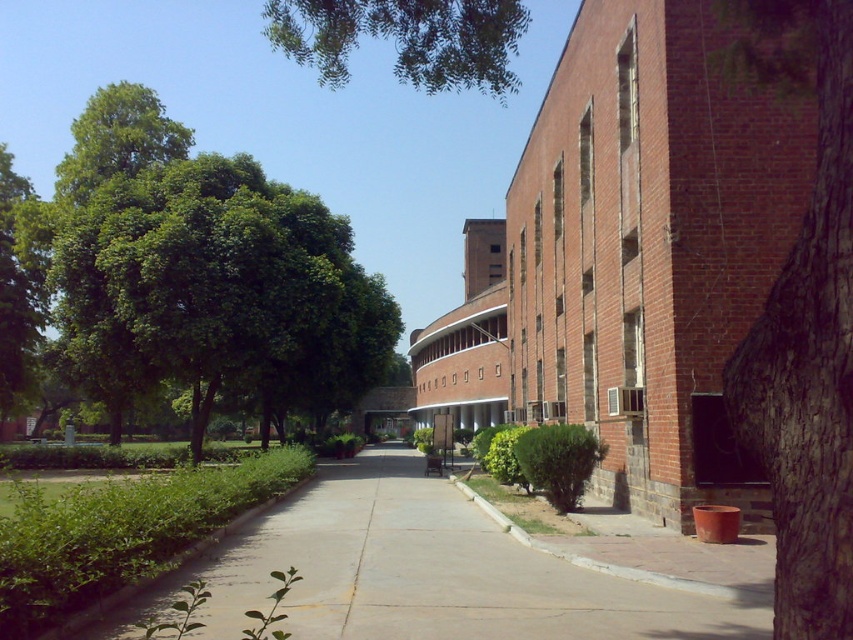
Who is positioned more to the right, green leafy tree at left or brown rough bark tree at right?

From the viewer's perspective, brown rough bark tree at right appears more on the right side.

Between point (128, 224) and point (828, 609), which one is positioned in front?

Point (828, 609)

The image size is (853, 640). Find the location of `green leafy tree at left`. green leafy tree at left is located at coordinates (199, 275).

Is smooth concrete pavement at center bigger than green leafy tree at upper center?

Incorrect, smooth concrete pavement at center is not larger than green leafy tree at upper center.

Is smooth concrete pavement at center below green leafy tree at upper center?

Indeed, smooth concrete pavement at center is positioned under green leafy tree at upper center.

Describe the element at coordinates (457, 570) in the screenshot. I see `smooth concrete pavement at center` at that location.

Where is `smooth concrete pavement at center`? smooth concrete pavement at center is located at coordinates (457, 570).

Can you confirm if green leafy tree at left is positioned to the left of smooth concrete pavement at center?

Yes, green leafy tree at left is to the left of smooth concrete pavement at center.

At what (x,y) coordinates should I click in order to perform the action: click on green leafy tree at left. Please return your answer as a coordinate pair (x, y). The width and height of the screenshot is (853, 640). Looking at the image, I should click on (199, 275).

You are a GUI agent. You are given a task and a screenshot of the screen. Output one action in this format:
    pyautogui.click(x=<x>, y=<y>)
    Task: Click on the green leafy tree at left
    The image size is (853, 640).
    Given the screenshot: What is the action you would take?
    pyautogui.click(x=199, y=275)

At what (x,y) coordinates should I click in order to perform the action: click on green leafy tree at left. Please return your answer as a coordinate pair (x, y). The image size is (853, 640). Looking at the image, I should click on (199, 275).